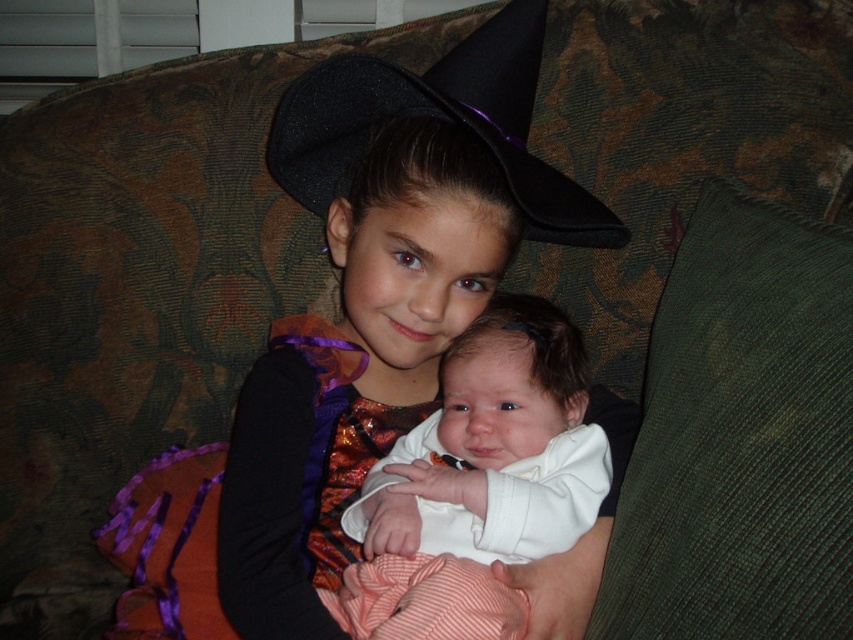
You are a photographer taking a picture of the white soft baby at center and the black felt witch hat at upper center. Which object should you focus on first if you want to capture both in focus, considering their sizes?

The white soft baby at center is much taller than the black felt witch hat at upper center, so focusing on the larger object first would ensure both are in focus.